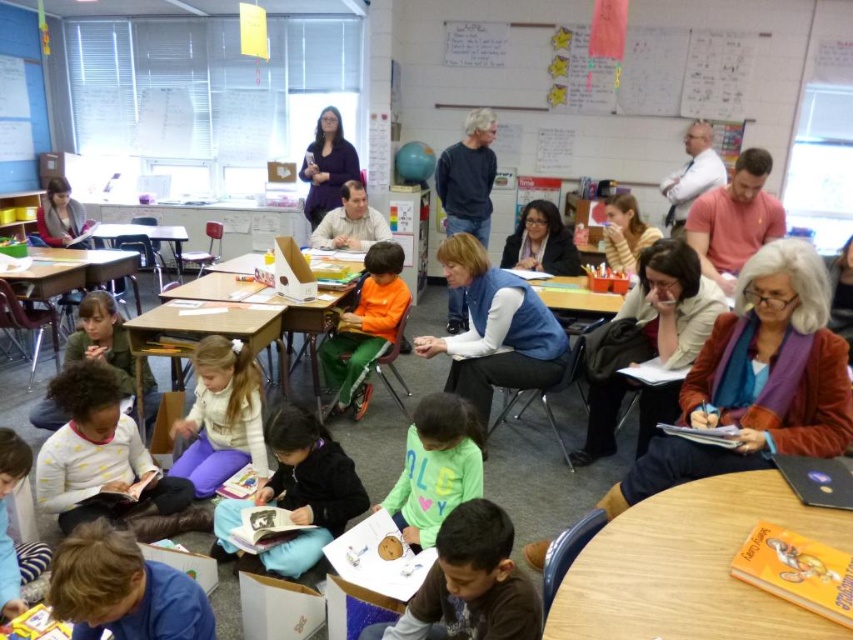
Question: Does white soft sweater at lower left appear over white shirt at upper right?

Choices:
 (A) no
 (B) yes

Answer: (A)

Question: Is brown hair at lower left positioned in front of green matte shirt at center?

Choices:
 (A) no
 (B) yes

Answer: (B)

Question: Which of the following is the farthest from the observer?

Choices:
 (A) (242, 349)
 (B) (96, 310)
 (C) (479, 234)

Answer: (C)

Question: Can you confirm if orange matte shirt at center is thinner than brown wooden table at upper left?

Choices:
 (A) no
 (B) yes

Answer: (B)

Question: Which point is farther from the camera taking this photo?

Choices:
 (A) (x=242, y=422)
 (B) (x=125, y=416)
 (C) (x=604, y=316)
 (D) (x=177, y=228)

Answer: (D)

Question: Which object is farther from the camera taking this photo?

Choices:
 (A) brown cotton shirt at lower center
 (B) green matte shirt at center
 (C) wooden table at lower right

Answer: (B)